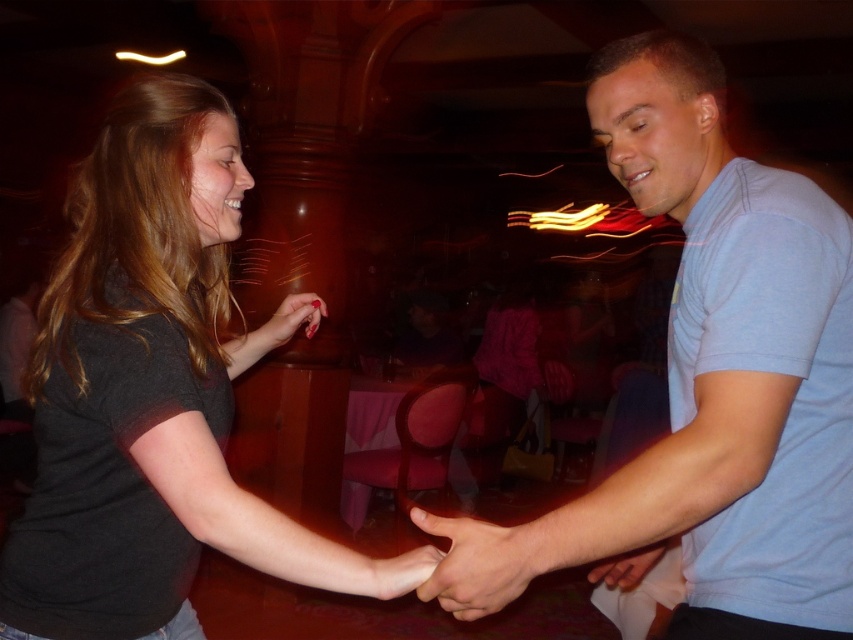
You are standing at the camera position and want to reach the point at coordinates point (x=535, y=547). There is an obstacle at point (x=718, y=579). Can you walk straight to the desired point without going around the obstacle?

Since point (x=718, y=579) is further to the camera than point (x=535, y=547), the obstacle at point (x=718, y=579) is closer to you. Therefore, you would need to go around the obstacle to reach point (x=535, y=547).

You are a photographer at this event and want to capture a photo of the two people. To ensure both the light blue cotton shirt at center and the smooth skin hand at center are in focus, which one should be closer to the camera?

The smooth skin hand at center is to the left of the light blue cotton shirt at center, so the light blue cotton shirt at center is further away from the camera. To have both in focus, the photographer should adjust the focus to account for the distance between them.